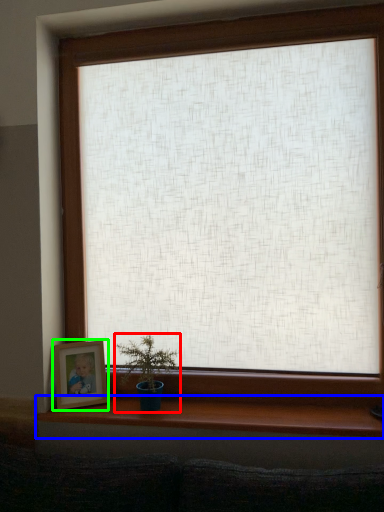
Question: Which object is positioned farthest from houseplant (highlighted by a red box)? Select from window sill (highlighted by a blue box) and picture frame (highlighted by a green box).

Choices:
 (A) window sill
 (B) picture frame

Answer: (A)